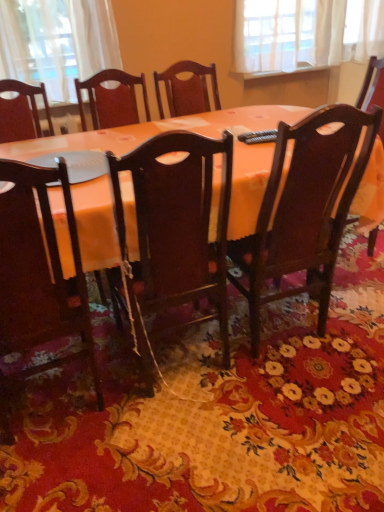
Locate an element on the screen. unoccupied region to the right of matte dark wood chair at lower left, the 3th chair in the right-to-left sequence is located at coordinates (158, 437).